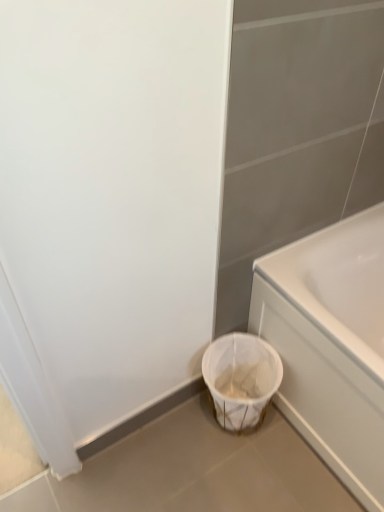
Question: Does white glossy bathtub at lower right have a lesser height compared to white woven laundry basket at lower center?

Choices:
 (A) yes
 (B) no

Answer: (B)

Question: Are white glossy bathtub at lower right and white woven laundry basket at lower center beside each other?

Choices:
 (A) no
 (B) yes

Answer: (A)

Question: Can you confirm if white glossy bathtub at lower right is bigger than white woven laundry basket at lower center?

Choices:
 (A) no
 (B) yes

Answer: (B)

Question: Does white glossy bathtub at lower right come behind white woven laundry basket at lower center?

Choices:
 (A) no
 (B) yes

Answer: (A)

Question: From the image's perspective, is white glossy bathtub at lower right on top of white woven laundry basket at lower center?

Choices:
 (A) no
 (B) yes

Answer: (B)

Question: From a real-world perspective, is white glossy bathtub at lower right located higher than white woven laundry basket at lower center?

Choices:
 (A) yes
 (B) no

Answer: (A)

Question: Does white woven laundry basket at lower center appear on the left side of white glossy bathtub at lower right?

Choices:
 (A) yes
 (B) no

Answer: (A)

Question: Does white woven laundry basket at lower center lie in front of white glossy bathtub at lower right?

Choices:
 (A) no
 (B) yes

Answer: (A)

Question: Is white woven laundry basket at lower center completely or partially outside of white glossy bathtub at lower right?

Choices:
 (A) yes
 (B) no

Answer: (A)

Question: From the image's perspective, is white woven laundry basket at lower center beneath white glossy bathtub at lower right?

Choices:
 (A) yes
 (B) no

Answer: (A)

Question: Is white woven laundry basket at lower center bigger than white glossy bathtub at lower right?

Choices:
 (A) yes
 (B) no

Answer: (B)

Question: Is the depth of white woven laundry basket at lower center greater than that of white glossy bathtub at lower right?

Choices:
 (A) yes
 (B) no

Answer: (A)

Question: Considering their positions, is white glossy bathtub at lower right located in front of or behind white woven laundry basket at lower center?

Choices:
 (A) front
 (B) behind

Answer: (A)